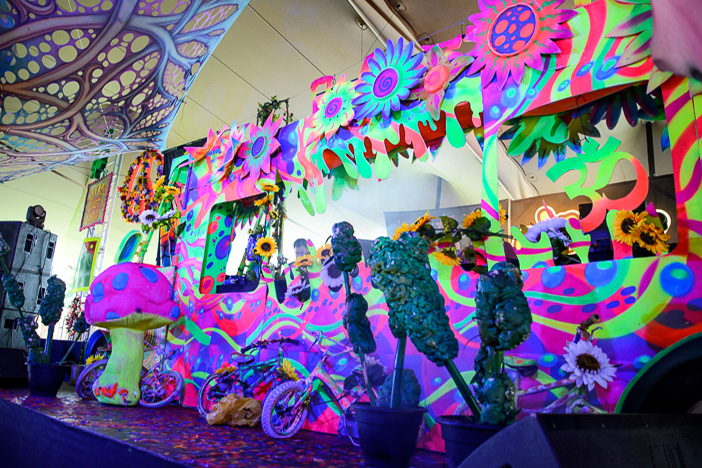
At what (x,y) coordinates should I click in order to perform the action: click on wall. Please return your answer as a coordinate pair (x, y). The image size is (702, 468). Looking at the image, I should click on (60, 212).